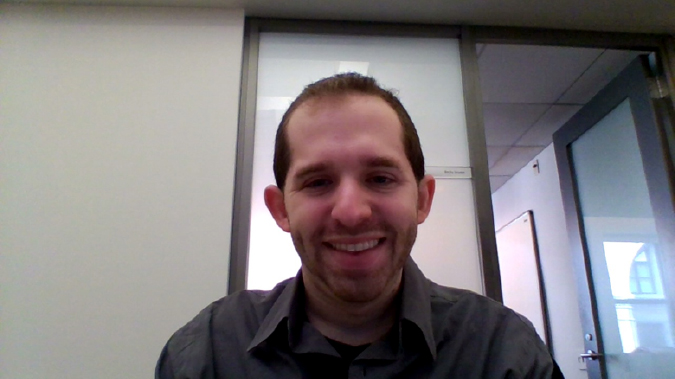
You are a GUI agent. You are given a task and a screenshot of the screen. Output one action in this format:
    pyautogui.click(x=<x>, y=<y>)
    Task: Click on the ceiling
    Image resolution: width=675 pixels, height=379 pixels.
    Given the screenshot: What is the action you would take?
    pyautogui.click(x=507, y=66)